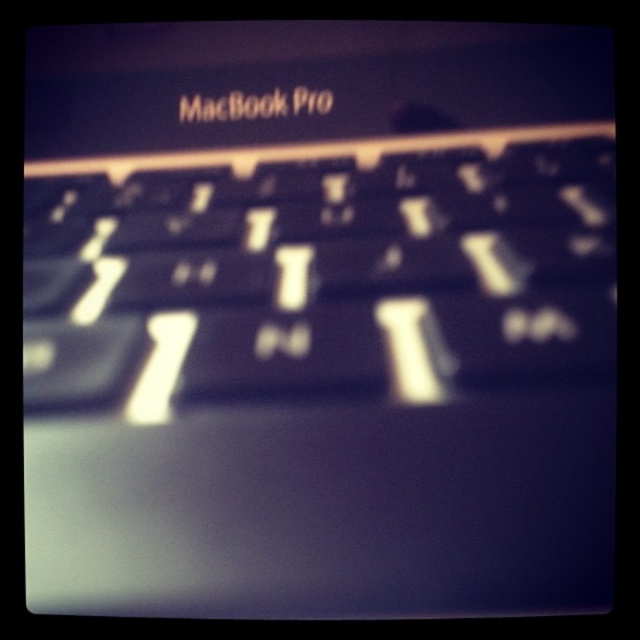
You are trying to clean the black matte keyboard at center and the black plastic macbook pro at upper center. Since both are black, you need to check their positions to avoid confusion. According to the image, which object is closer to you?

The black matte keyboard at center is closer to you because it is in front of the black plastic macbook pro at upper center.

You are a photographer trying to focus on two points on a MacBook Pro keyboard. You see the point at coordinates point (528, 220) and the point at coordinates point (109, 102). Which point is closer to the camera?

Point (528, 220) is in front of point (109, 102), so it is closer to the camera.